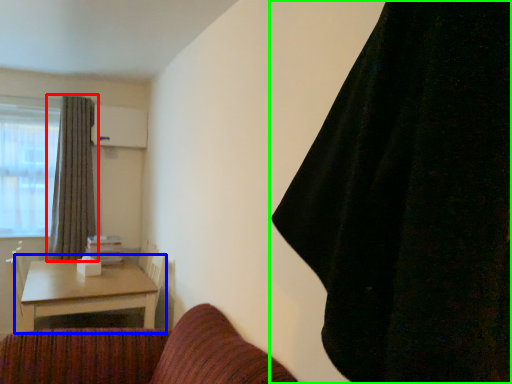
Question: Which object is the farthest from curtain (highlighted by a red box)? Choose among these: table (highlighted by a blue box) or curtain (highlighted by a green box).

Choices:
 (A) table
 (B) curtain

Answer: (B)